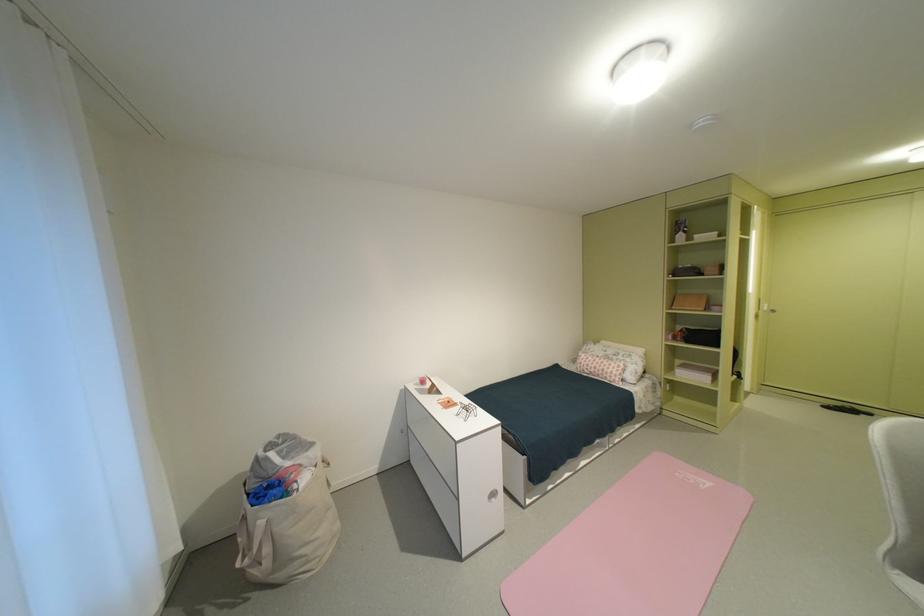
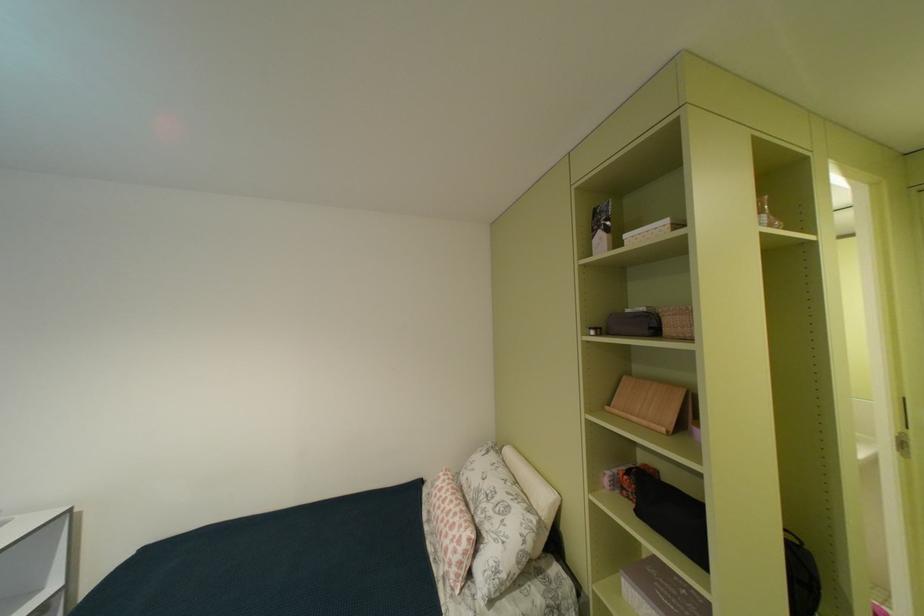
Locate, in the second image, the point that corresponds to (x=725, y=235) in the first image.

(676, 223)